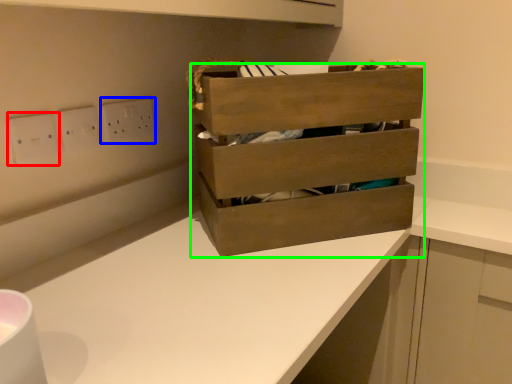
Question: Which is farther away from electric outlet (highlighted by a red box)? electric outlet (highlighted by a blue box) or chest of drawers (highlighted by a green box)?

Choices:
 (A) electric outlet
 (B) chest of drawers

Answer: (B)